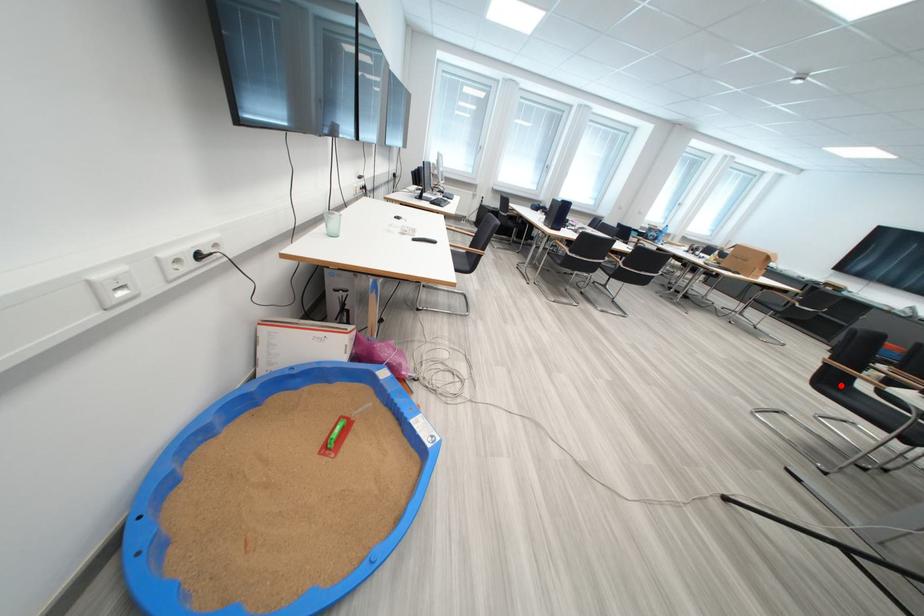
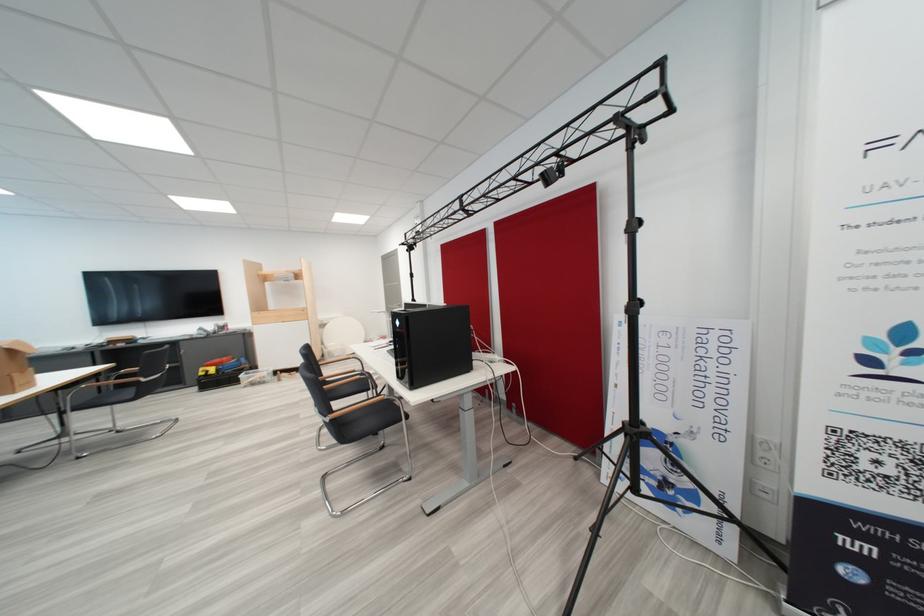
Question: I am providing you with two images of the same scene from different viewpoints. A red point is shown in image1. For the corresponding object point in image2, is it positioned nearer or farther from the camera?

Choices:
 (A) Nearer
 (B) Farther

Answer: (A)